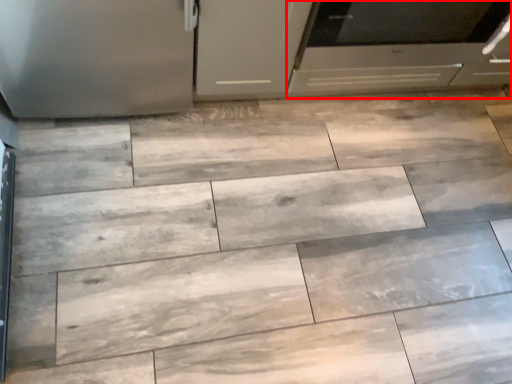
Question: From the image's perspective, where is oven (annotated by the red box) located relative to cabinetry?

Choices:
 (A) below
 (B) above

Answer: (B)